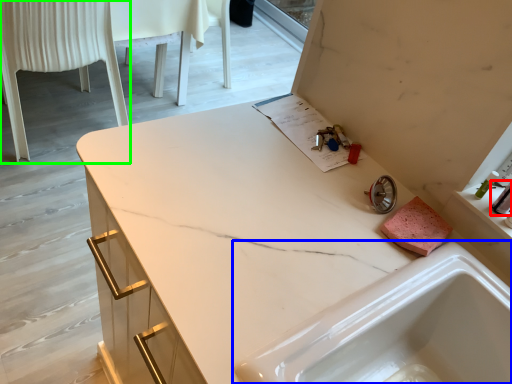
Question: Estimate the real-world distances between objects in this image. Which object is farther from toiletry (highlighted by a red box), sink (highlighted by a blue box) or chair (highlighted by a green box)?

Choices:
 (A) sink
 (B) chair

Answer: (B)